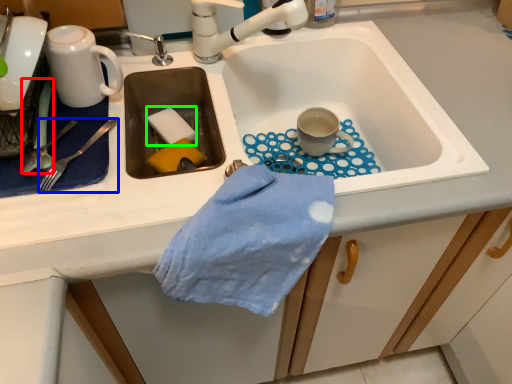
Question: Based on their relative distances, which object is nearer to silverware (highlighted by a red box)? Choose from silverware (highlighted by a blue box) and food (highlighted by a green box).

Choices:
 (A) silverware
 (B) food

Answer: (A)